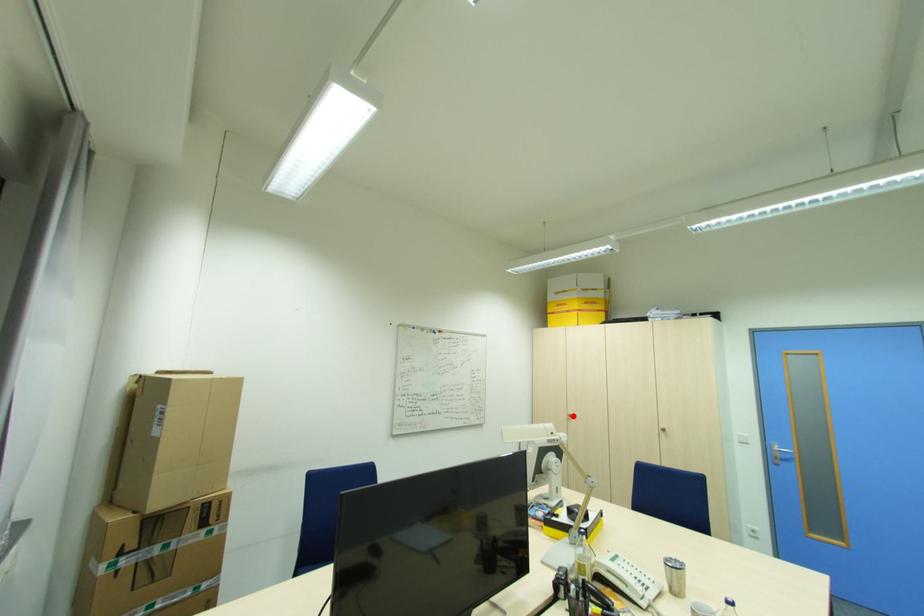
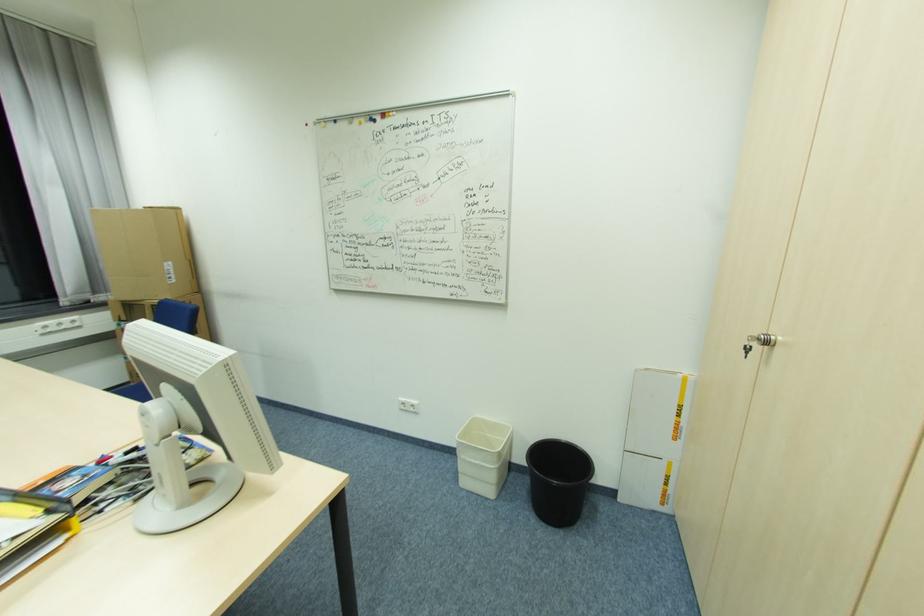
Find the pixel in the second image that matches the highlighted location in the first image.

(772, 344)